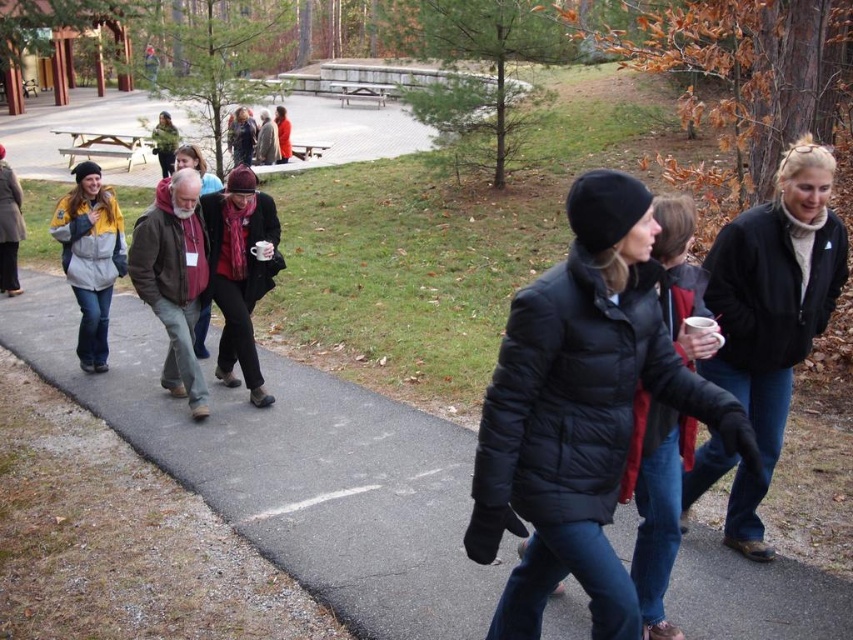
Question: Considering the real-world distances, which object is farthest from the brown leather jacket at center?

Choices:
 (A) matte red scarf at center
 (B) black puffy jacket at center
 (C) yellow and gray jacket at center

Answer: (A)

Question: Is knitted wool scarf at center to the right of matte red scarf at center from the viewer's perspective?

Choices:
 (A) yes
 (B) no

Answer: (A)

Question: Which point is farther to the camera?

Choices:
 (A) yellow and gray jacket at center
 (B) black fleece jacket at center
 (C) green wool sweater at upper left

Answer: (C)

Question: Is brown leather jacket at center further to camera compared to knitted wool scarf at center?

Choices:
 (A) no
 (B) yes

Answer: (A)

Question: Estimate the real-world distances between objects in this image. Which object is closer to the black puffy jacket at center?

Choices:
 (A) matte red scarf at center
 (B) green wool sweater at upper left

Answer: (B)

Question: Is matte yellow jacket at left further to the viewer compared to matte red scarf at center?

Choices:
 (A) no
 (B) yes

Answer: (A)